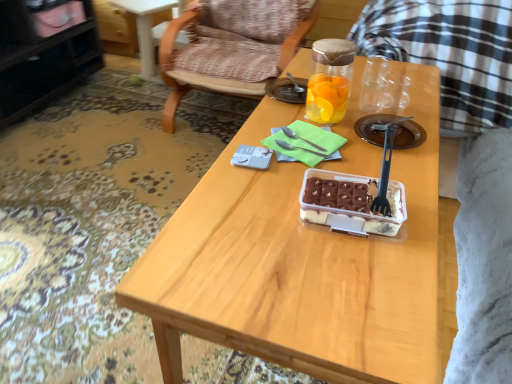
This screenshot has height=384, width=512. Find the location of `space that is in front of black plastic fork at center, which is the first fork in front-to-back order`. space that is in front of black plastic fork at center, which is the first fork in front-to-back order is located at coordinates (381, 257).